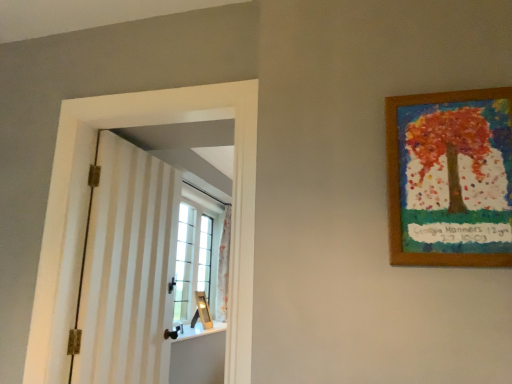
Question: Is beige striped barn door at left to the left or to the right of wooden picture frame at upper right in the image?

Choices:
 (A) right
 (B) left

Answer: (B)

Question: In the image, is beige striped barn door at left positioned in front of or behind wooden picture frame at upper right?

Choices:
 (A) behind
 (B) front

Answer: (A)

Question: Choose the correct answer: Is beige striped barn door at left inside wooden picture frame at upper right or outside it?

Choices:
 (A) outside
 (B) inside

Answer: (A)

Question: Is wooden picture frame at upper right to the left or to the right of beige striped barn door at left in the image?

Choices:
 (A) left
 (B) right

Answer: (B)

Question: Is wooden picture frame at upper right in front of or behind beige striped barn door at left in the image?

Choices:
 (A) front
 (B) behind

Answer: (A)

Question: From their relative heights in the image, would you say wooden picture frame at upper right is taller or shorter than beige striped barn door at left?

Choices:
 (A) tall
 (B) short

Answer: (B)

Question: Is point (428, 122) positioned closer to the camera than point (168, 306)?

Choices:
 (A) closer
 (B) farther

Answer: (A)